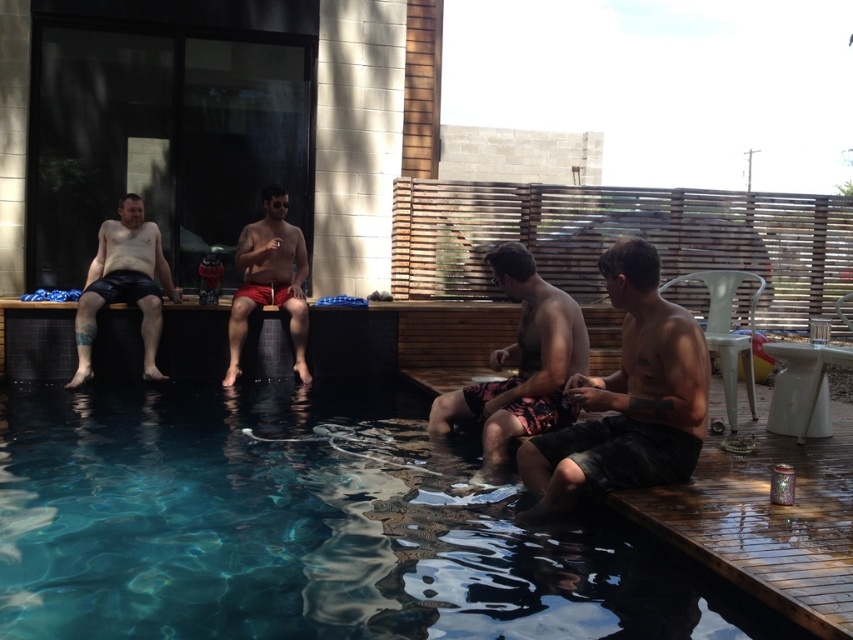
Question: Which object is closer to the camera taking this photo?

Choices:
 (A) dark gray shorts at center
 (B) clear blue water at lower left

Answer: (B)

Question: Which of the following is the farthest from the observer?

Choices:
 (A) (78, 321)
 (B) (677, 461)
 (C) (244, 438)

Answer: (A)

Question: Is dark gray shorts at center to the left of camouflage shorts at center from the viewer's perspective?

Choices:
 (A) no
 (B) yes

Answer: (A)

Question: From the image, what is the correct spatial relationship of camouflage shorts at center in relation to leather shorts at left?

Choices:
 (A) left
 (B) right

Answer: (B)

Question: Which object appears farthest from the camera in this image?

Choices:
 (A) leather shorts at left
 (B) clear blue water at lower left
 (C) dark gray shorts at center

Answer: (A)

Question: Can you confirm if dark gray shorts at center is positioned to the right of matte red shorts at center?

Choices:
 (A) no
 (B) yes

Answer: (B)